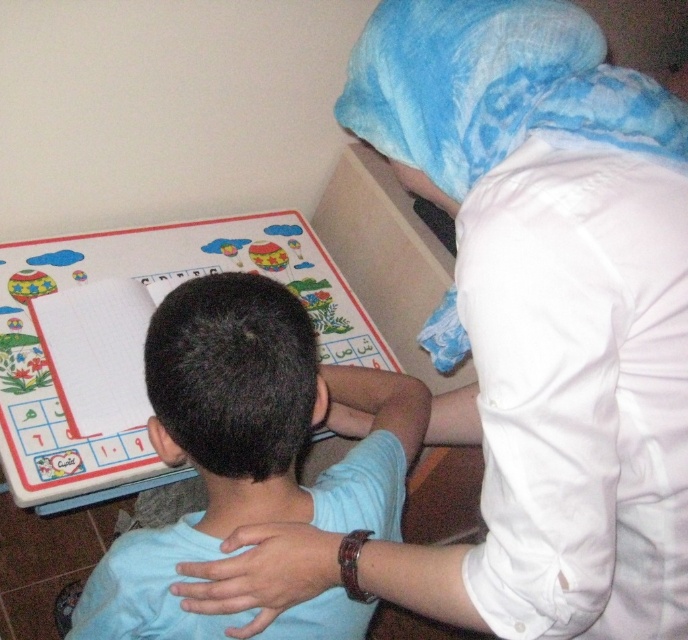
Question: Does light blue shirt at center appear on the right side of blue fabric at upper right?

Choices:
 (A) yes
 (B) no

Answer: (B)

Question: Which object is farther from the camera taking this photo?

Choices:
 (A) light blue shirt at center
 (B) blue fabric at upper right

Answer: (A)

Question: Is light blue shirt at center smaller than blue fabric at upper right?

Choices:
 (A) no
 (B) yes

Answer: (A)

Question: Is light blue shirt at center closer to the viewer compared to blue fabric at upper right?

Choices:
 (A) yes
 (B) no

Answer: (B)

Question: Which object is closer to the camera taking this photo?

Choices:
 (A) blue fabric at upper right
 (B) light blue shirt at center

Answer: (A)